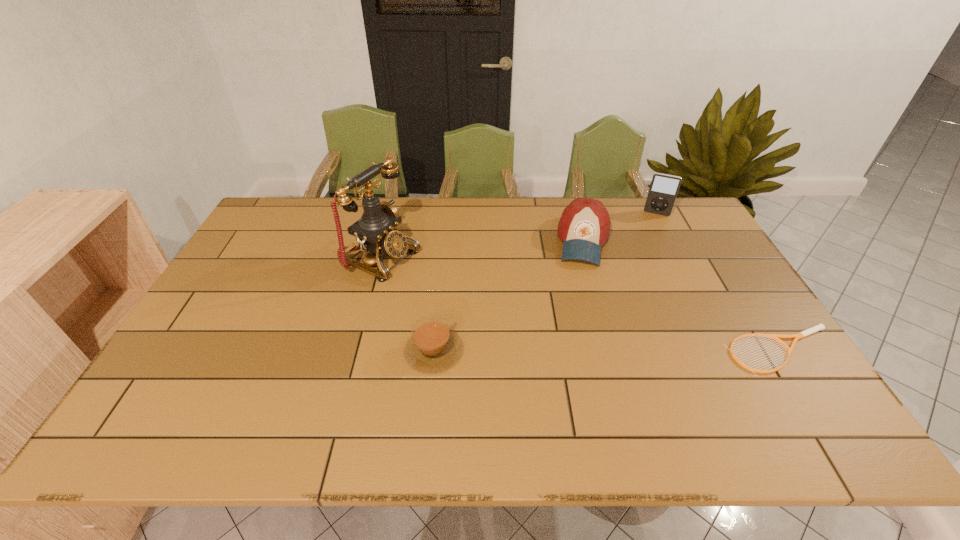
Find the location of `vacant area that lies between the telephone and the fourth tallest object`. vacant area that lies between the telephone and the fourth tallest object is located at coordinates (407, 304).

The image size is (960, 540). Find the location of `vacant point located between the cappuccino and the iPod`. vacant point located between the cappuccino and the iPod is located at coordinates (545, 282).

Find the location of a particular element. Image resolution: width=960 pixels, height=540 pixels. free space between the second tallest object and the cappuccino is located at coordinates (545, 282).

Where is `object that is the third closest to the telephone`? Image resolution: width=960 pixels, height=540 pixels. object that is the third closest to the telephone is located at coordinates (664, 188).

Select which object appears as the second closest to the fourth shortest object. Please provide its 2D coordinates. Your answer should be formatted as a tuple, i.e. [(x, y)], where the tuple contains the x and y coordinates of a point satisfying the conditions above.

[(819, 327)]